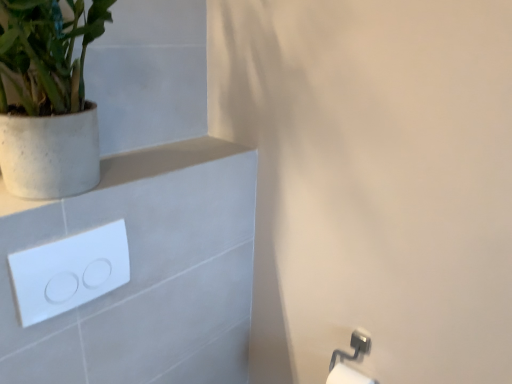
What do you see at coordinates (48, 99) in the screenshot? This screenshot has height=384, width=512. I see `white speckled concrete pot at upper left` at bounding box center [48, 99].

What do you see at coordinates (163, 160) in the screenshot? I see `white matte concrete at upper left` at bounding box center [163, 160].

Find the location of a particular element. The image size is (512, 384). white glossy toilet paper at lower right is located at coordinates (347, 376).

Locate an element on the screen. This screenshot has height=384, width=512. white speckled concrete pot at upper left is located at coordinates click(x=48, y=99).

From the picture: Is white speckled concrete pot at upper left wider or thinner than white matte concrete at upper left?

Clearly, white speckled concrete pot at upper left has more width compared to white matte concrete at upper left.

Measure the distance from white speckled concrete pot at upper left to white matte concrete at upper left.

white speckled concrete pot at upper left and white matte concrete at upper left are 7.86 inches apart.

Is white speckled concrete pot at upper left at the right side of white matte concrete at upper left?

Incorrect, white speckled concrete pot at upper left is not on the right side of white matte concrete at upper left.

Is white speckled concrete pot at upper left facing away from white matte concrete at upper left?

No, white speckled concrete pot at upper left is not facing away from white matte concrete at upper left.

Based on the photo, do you think white glossy toilet paper at lower right is within white matte concrete at upper left, or outside of it?

white glossy toilet paper at lower right is not enclosed by white matte concrete at upper left.

How distant is white glossy toilet paper at lower right from white matte concrete at upper left?

Result: They are 77.17 centimeters apart.

Is white glossy toilet paper at lower right touching white matte concrete at upper left?

There is a gap between white glossy toilet paper at lower right and white matte concrete at upper left.

From the picture: Which object is closer to the camera taking this photo, white glossy toilet paper at lower right or white matte concrete at upper left?

Positioned in front is white matte concrete at upper left.

You are a GUI agent. You are given a task and a screenshot of the screen. Output one action in this format:
    pyautogui.click(x=<x>, y=<y>)
    Task: Click on the light switch below the white matte concrete at upper left (from a real-world perspective)
    The height and width of the screenshot is (384, 512).
    Given the screenshot: What is the action you would take?
    pyautogui.click(x=69, y=272)

Is white matte concrete at upper left looking in the opposite direction of white glossy/light switch at upper left?

white matte concrete at upper left is not turned away from white glossy/light switch at upper left.

From a real-world perspective, is white matte concrete at upper left located higher than white glossy/light switch at upper left?

Yes, from a real-world perspective, white matte concrete at upper left is above white glossy/light switch at upper left.

Is white speckled concrete pot at upper left far from white glossy toilet paper at lower right?

Yes, white speckled concrete pot at upper left and white glossy toilet paper at lower right are quite far apart.

How different are the orientations of white speckled concrete pot at upper left and white glossy toilet paper at lower right in degrees?

The angular difference between white speckled concrete pot at upper left and white glossy toilet paper at lower right is 89.2 degrees.

In the scene shown: Which of these two, white speckled concrete pot at upper left or white glossy toilet paper at lower right, is smaller?

white glossy toilet paper at lower right.

Could you measure the distance between white speckled concrete pot at upper left and white glossy toilet paper at lower right?

white speckled concrete pot at upper left and white glossy toilet paper at lower right are 1.01 meters apart from each other.

Identify the location of light switch in front of the white glossy toilet paper at lower right. (69, 272).

From the picture: Which of these two, white glossy toilet paper at lower right or white glossy/light switch at upper left, is thinner?

Thinner between the two is white glossy/light switch at upper left.

Is white glossy toilet paper at lower right positioned in front of white glossy/light switch at upper left?

No.

From the image's perspective, is white glossy toilet paper at lower right positioned above or below white glossy/light switch at upper left?

Based on their image positions, white glossy toilet paper at lower right is located beneath white glossy/light switch at upper left.

Can you see white glossy/light switch at upper left touching white speckled concrete pot at upper left?

No, white glossy/light switch at upper left is not beside white speckled concrete pot at upper left.

Is white glossy/light switch at upper left positioned in front of white speckled concrete pot at upper left?

No.

Is white glossy/light switch at upper left at the left side of white speckled concrete pot at upper left?

Incorrect, white glossy/light switch at upper left is not on the left side of white speckled concrete pot at upper left.

Would you say white glossy/light switch at upper left is inside or outside white speckled concrete pot at upper left?

white glossy/light switch at upper left lies outside white speckled concrete pot at upper left.

From the image's perspective, is white glossy/light switch at upper left above or below white glossy toilet paper at lower right?

white glossy/light switch at upper left is situated higher than white glossy toilet paper at lower right in the image.

Is white glossy/light switch at upper left located outside white glossy toilet paper at lower right?

That's correct, white glossy/light switch at upper left is outside of white glossy toilet paper at lower right.

Which is more to the left, white glossy/light switch at upper left or white glossy toilet paper at lower right?

From the viewer's perspective, white glossy/light switch at upper left appears more on the left side.

Locate an element on the screen. light switch located in front of the white glossy toilet paper at lower right is located at coordinates (69, 272).

At what (x,y) coordinates should I click in order to perform the action: click on balustrade behind the white speckled concrete pot at upper left. Please return your answer as a coordinate pair (x, y). Looking at the image, I should click on (163, 160).

I want to click on balustrade that appears above the white glossy toilet paper at lower right (from a real-world perspective), so click(x=163, y=160).

Estimate the real-world distances between objects in this image. Which object is further from white glossy/light switch at upper left, white glossy toilet paper at lower right or white speckled concrete pot at upper left?

Among the two, white glossy toilet paper at lower right is located further to white glossy/light switch at upper left.

Estimate the real-world distances between objects in this image. Which object is closer to white glossy/light switch at upper left, white speckled concrete pot at upper left or white glossy toilet paper at lower right?

Among the two, white speckled concrete pot at upper left is located nearer to white glossy/light switch at upper left.

Looking at the image, which one is located further to white glossy/light switch at upper left, white speckled concrete pot at upper left or white matte concrete at upper left?

white speckled concrete pot at upper left is positioned further to the anchor white glossy/light switch at upper left.

Considering their positions, is white glossy/light switch at upper left positioned closer to white matte concrete at upper left than white speckled concrete pot at upper left?

white glossy/light switch at upper left is closer to white matte concrete at upper left.

Considering their positions, is white glossy toilet paper at lower right positioned further to white speckled concrete pot at upper left than white matte concrete at upper left?

Among the two, white glossy toilet paper at lower right is located further to white speckled concrete pot at upper left.

Estimate the real-world distances between objects in this image. Which object is further from white matte concrete at upper left, white glossy/light switch at upper left or white glossy toilet paper at lower right?

The object further to white matte concrete at upper left is white glossy toilet paper at lower right.

Looking at the image, which one is located further to white glossy toilet paper at lower right, white glossy/light switch at upper left or white speckled concrete pot at upper left?

white speckled concrete pot at upper left is positioned further to the anchor white glossy toilet paper at lower right.

Considering their positions, is white glossy/light switch at upper left positioned further to white speckled concrete pot at upper left than white matte concrete at upper left?

white glossy/light switch at upper left lies further to white speckled concrete pot at upper left than the other object.

Locate an element on the screen. balustrade between white speckled concrete pot at upper left and white glossy/light switch at upper left from top to bottom is located at coordinates (163, 160).

This screenshot has width=512, height=384. What are the coordinates of `light switch that lies between white speckled concrete pot at upper left and white glossy toilet paper at lower right from top to bottom` in the screenshot? It's located at (69, 272).

In order to click on balustrade between white speckled concrete pot at upper left and white glossy toilet paper at lower right from top to bottom in this screenshot , I will do `click(163, 160)`.

Find the location of `balustrade situated between white glossy/light switch at upper left and white glossy toilet paper at lower right from left to right`. balustrade situated between white glossy/light switch at upper left and white glossy toilet paper at lower right from left to right is located at coordinates (163, 160).